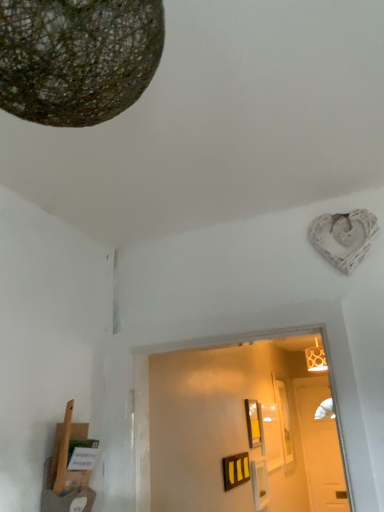
This screenshot has width=384, height=512. Describe the element at coordinates (320, 447) in the screenshot. I see `white wooden door at center` at that location.

I want to click on matte yellow picture frame at center, so click(x=253, y=423).

Is matte yellow picture frame at center next to white wooden door at center and touching it?

No, matte yellow picture frame at center is not beside white wooden door at center.

Who is smaller, matte yellow picture frame at center or white wooden door at center?

Smaller between the two is matte yellow picture frame at center.

Is matte yellow picture frame at center located outside white wooden door at center?

Absolutely, matte yellow picture frame at center is external to white wooden door at center.

From the image's perspective, would you say matte yellow picture frame at center is positioned over white wooden door at center?

Correct, matte yellow picture frame at center appears higher than white wooden door at center in the image.

In order to click on lamp positioned vertically above the matte yellow picture frame at center (from a real-world perspective) in this screenshot , I will do `click(77, 58)`.

Which of these two, matte yellow picture frame at center or textured brown sphere at upper left, is wider?

Wider between the two is textured brown sphere at upper left.

Is matte yellow picture frame at center turned away from textured brown sphere at upper left?

matte yellow picture frame at center does not have its back to textured brown sphere at upper left.

Considering the points (245, 401) and (119, 85), which point is behind, point (245, 401) or point (119, 85)?

The point (245, 401) is more distant.

Is white wooden door at center placed right next to matte yellow picture frame at center?

white wooden door at center and matte yellow picture frame at center are clearly separated.

Which object is thinner, white wooden door at center or matte yellow picture frame at center?

matte yellow picture frame at center is thinner.

Does white wooden door at center appear on the left side of matte yellow picture frame at center?

No, white wooden door at center is not to the left of matte yellow picture frame at center.

Considering the sizes of textured brown sphere at upper left and white wooden door at center in the image, is textured brown sphere at upper left taller or shorter than white wooden door at center?

In the image, textured brown sphere at upper left appears to be shorter than white wooden door at center.

In the image, there is a textured brown sphere at upper left. Identify the location of door below it (from the image's perspective). The width and height of the screenshot is (384, 512). (320, 447).

Considering the positions of objects textured brown sphere at upper left and white wooden door at center in the image provided, who is more to the left, textured brown sphere at upper left or white wooden door at center?

textured brown sphere at upper left.

From the image's perspective, is textured brown sphere at upper left located beneath white wooden door at center?

No, from the image's perspective, textured brown sphere at upper left is not beneath white wooden door at center.

Is textured brown sphere at upper left to the left of matte yellow picture frame at center from the viewer's perspective?

Yes, textured brown sphere at upper left is to the left of matte yellow picture frame at center.

Is matte yellow picture frame at center at the back of textured brown sphere at upper left?

No.

Considering the positions of point (44, 114) and point (255, 413), is point (44, 114) closer or farther from the camera than point (255, 413)?

Clearly, point (44, 114) is closer to the camera than point (255, 413).

How many degrees apart are the facing directions of textured brown sphere at upper left and matte yellow picture frame at center?

88.3 degrees separate the facing orientations of textured brown sphere at upper left and matte yellow picture frame at center.

Considering the positions of objects white wooden door at center and textured brown sphere at upper left in the image provided, who is more to the left, white wooden door at center or textured brown sphere at upper left?

textured brown sphere at upper left is more to the left.

Between white wooden door at center and textured brown sphere at upper left, which one has larger size?

white wooden door at center.

Is textured brown sphere at upper left a part of white wooden door at center?

No, white wooden door at center does not contain textured brown sphere at upper left.

Based on the photo, does white wooden door at center have a greater width compared to textured brown sphere at upper left?

No, white wooden door at center is not wider than textured brown sphere at upper left.

In order to click on door to the right of matte yellow picture frame at center in this screenshot , I will do `click(320, 447)`.

This screenshot has height=512, width=384. I want to click on picture frame below the textured brown sphere at upper left (from a real-world perspective), so click(253, 423).

Estimate the real-world distances between objects in this image. Which object is closer to white wooden door at center, matte yellow picture frame at center or textured brown sphere at upper left?

The object closer to white wooden door at center is matte yellow picture frame at center.

Based on their spatial positions, is textured brown sphere at upper left or white wooden door at center closer to matte yellow picture frame at center?

white wooden door at center is closer to matte yellow picture frame at center.

Based on their spatial positions, is textured brown sphere at upper left or matte yellow picture frame at center closer to white wooden door at center?

Based on the image, matte yellow picture frame at center appears to be nearer to white wooden door at center.

Based on their spatial positions, is white wooden door at center or textured brown sphere at upper left further from matte yellow picture frame at center?

textured brown sphere at upper left.

From the image, which object appears to be nearer to textured brown sphere at upper left, matte yellow picture frame at center or white wooden door at center?

The object closer to textured brown sphere at upper left is matte yellow picture frame at center.

From the image, which object appears to be nearer to textured brown sphere at upper left, white wooden door at center or matte yellow picture frame at center?

matte yellow picture frame at center is positioned closer to the anchor textured brown sphere at upper left.

Find the location of a particular element. This screenshot has width=384, height=512. picture frame positioned between textured brown sphere at upper left and white wooden door at center from near to far is located at coordinates (253, 423).